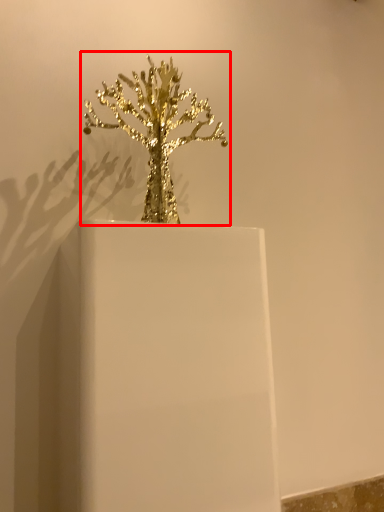
Question: In this image, where is houseplant (annotated by the red box) located relative to candle holder?

Choices:
 (A) right
 (B) left

Answer: (A)